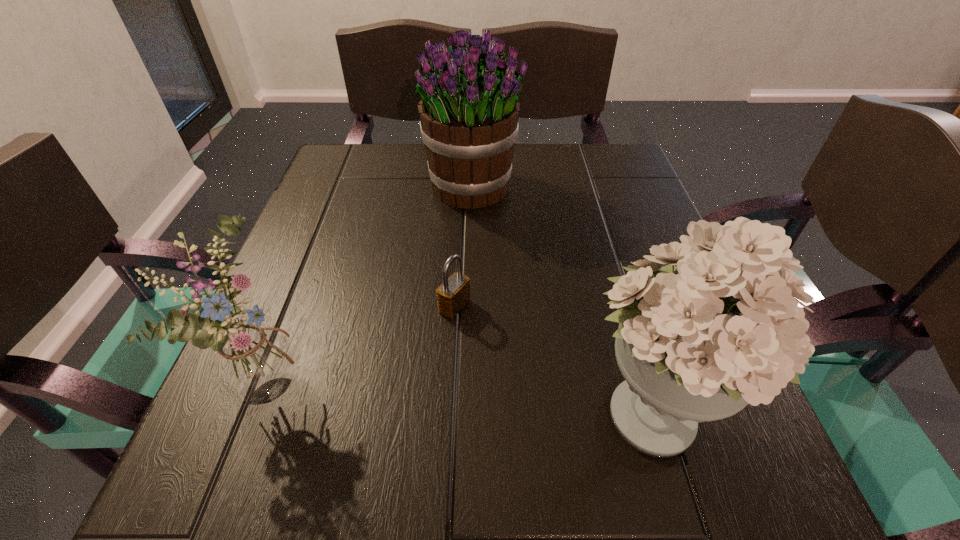
Locate an element on the screen. the farthest object is located at coordinates (469, 111).

Find the location of a particular element. the second bouquet from right to left is located at coordinates (469, 111).

What are the coordinates of `the rightmost bouquet` in the screenshot? It's located at (727, 331).

You are a GUI agent. You are given a task and a screenshot of the screen. Output one action in this format:
    pyautogui.click(x=<x>, y=<y>)
    Task: Click on the shortest bouquet
    The image size is (960, 540).
    Given the screenshot: What is the action you would take?
    pyautogui.click(x=254, y=366)

Locate an element on the screen. The width and height of the screenshot is (960, 540). the leftmost object is located at coordinates (254, 366).

At what (x,y) coordinates should I click in order to perform the action: click on the shortest object. Please return your answer as a coordinate pair (x, y). The width and height of the screenshot is (960, 540). Looking at the image, I should click on (453, 294).

Find the location of a particular element. The width and height of the screenshot is (960, 540). the second farthest object is located at coordinates (453, 294).

This screenshot has width=960, height=540. Find the location of `vacant space located on the front of the second bouquet from right to left`. vacant space located on the front of the second bouquet from right to left is located at coordinates (470, 314).

Where is `free point located on the left of the rightmost bouquet`? free point located on the left of the rightmost bouquet is located at coordinates (350, 409).

Image resolution: width=960 pixels, height=540 pixels. Find the location of `vacant space located on the front-facing side of the leftmost bouquet`. vacant space located on the front-facing side of the leftmost bouquet is located at coordinates (540, 380).